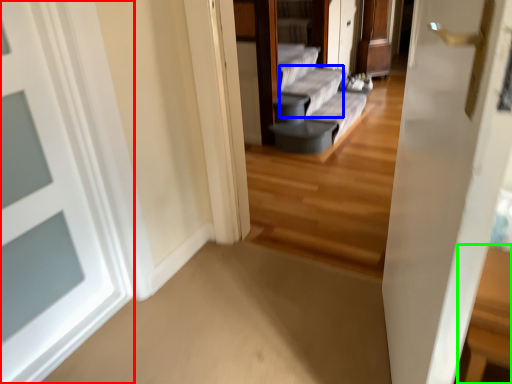
Question: Considering the real-world distances, which object is closest to door (highlighted by a red box)? couch (highlighted by a blue box) or table (highlighted by a green box).

Choices:
 (A) couch
 (B) table

Answer: (B)